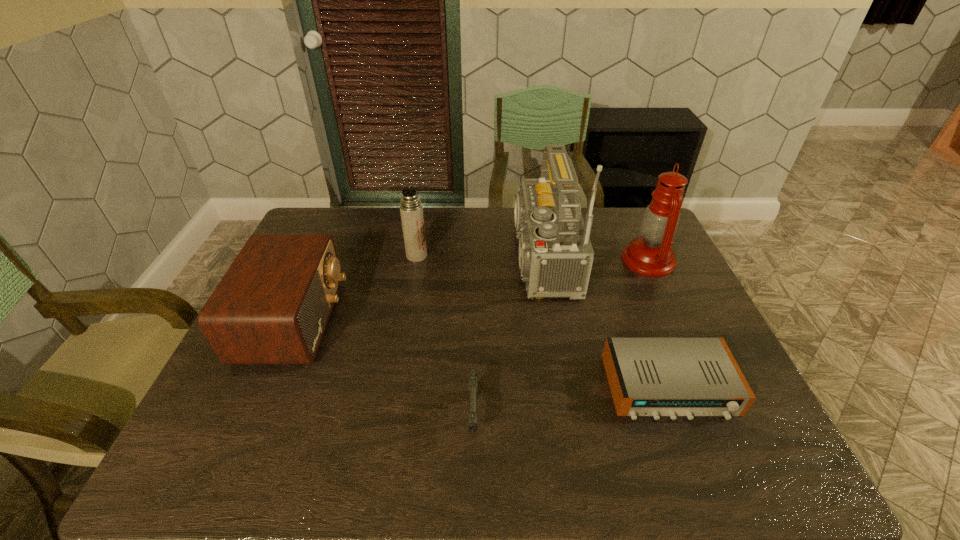
Where is `free space between the rightmost radio receiver and the fifth shortest object`? The height and width of the screenshot is (540, 960). free space between the rightmost radio receiver and the fifth shortest object is located at coordinates (659, 323).

The height and width of the screenshot is (540, 960). I want to click on empty space between the third object from right to left and the thermos bottle, so click(475, 257).

Image resolution: width=960 pixels, height=540 pixels. Identify the location of unoccupied position between the fourth tallest object and the thermos bottle. (355, 288).

Locate an element on the screen. vacant area between the thermos bottle and the shortest object is located at coordinates (543, 321).

Where is `vacant space in between the tallest radio receiver and the leftmost radio receiver`? The image size is (960, 540). vacant space in between the tallest radio receiver and the leftmost radio receiver is located at coordinates (415, 289).

Where is `unoccupied position between the second shortest radio receiver and the oil lamp`? This screenshot has width=960, height=540. unoccupied position between the second shortest radio receiver and the oil lamp is located at coordinates (471, 291).

What are the coordinates of `free space between the rightmost radio receiver and the leftmost object` in the screenshot? It's located at (482, 354).

Locate an element on the screen. This screenshot has width=960, height=540. vacant space that is in between the second shortest radio receiver and the rightmost radio receiver is located at coordinates (482, 354).

Identify which object is the third nearest to the oil lamp. Please provide its 2D coordinates. Your answer should be formatted as a tuple, i.e. [(x, y)], where the tuple contains the x and y coordinates of a point satisfying the conditions above.

[(473, 376)]

This screenshot has width=960, height=540. I want to click on object that is the fourth closest to the shortest object, so click(x=411, y=209).